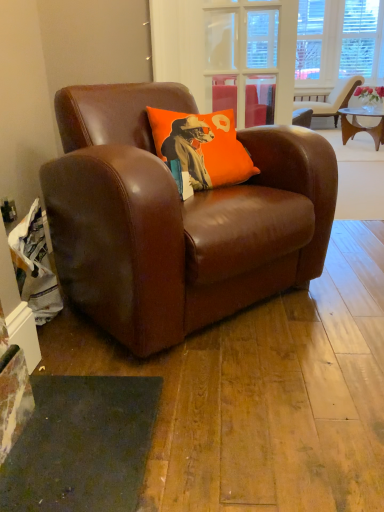
Question: Which is correct: transparent glass door at upper center is inside brown leather chair at center, positioned as the second chair in top-to-bottom order, or outside of it?

Choices:
 (A) outside
 (B) inside

Answer: (A)

Question: Considering the positions of transparent glass door at upper center and brown leather chair at center, positioned as the second chair in back-to-front order, in the image, is transparent glass door at upper center bigger or smaller than brown leather chair at center, positioned as the second chair in back-to-front order,?

Choices:
 (A) small
 (B) big

Answer: (A)

Question: Estimate the real-world distances between objects in this image. Which object is closer to the transparent glass door at upper center?

Choices:
 (A) beige leather chair at upper right, which is the second chair in left-to-right order
 (B) brown leather chair at center, which is counted as the 1th chair, starting from the bottom
 (C) orange fabric pillow at center

Answer: (C)

Question: Considering the real-world distances, which object is closest to the orange fabric pillow at center?

Choices:
 (A) beige leather chair at upper right, arranged as the first chair when viewed from the back
 (B) brown leather chair at center, which is counted as the 1th chair, starting from the bottom
 (C) transparent glass door at upper center

Answer: (B)